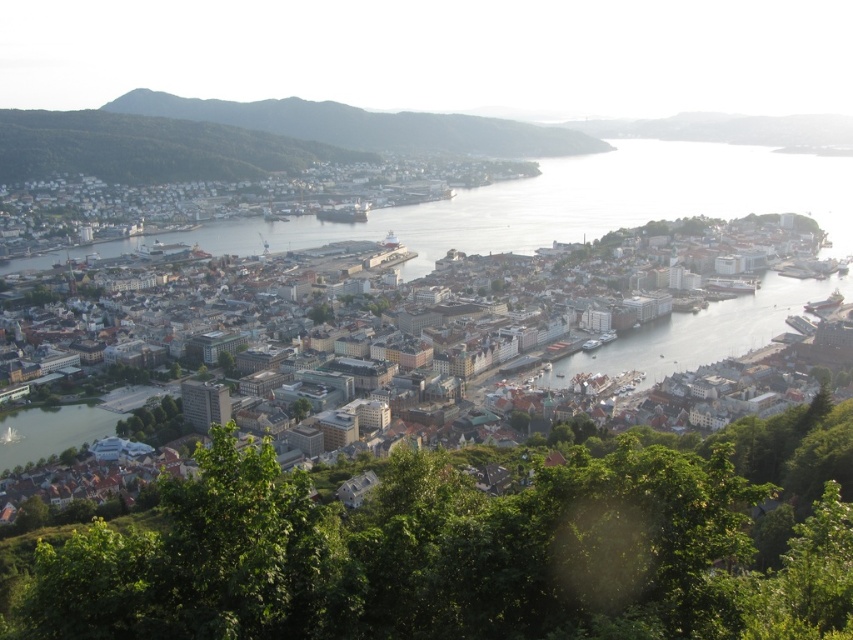
Does green leafy tree at lower center have a greater height compared to green forested hillside at upper left?

In fact, green leafy tree at lower center may be shorter than green forested hillside at upper left.

Who is higher up, green leafy tree at lower center or green forested hillside at upper left?

green forested hillside at upper left is higher up.

Who is more distant from viewer, (679,600) or (419,125)?

The point (419,125) is more distant.

Where is `green leafy tree at lower center`? Image resolution: width=853 pixels, height=640 pixels. green leafy tree at lower center is located at coordinates (466, 552).

How much distance is there between green leafy tree at lower center and white matte buildings at center?

green leafy tree at lower center and white matte buildings at center are 682.88 feet apart.

Is green leafy tree at lower center thinner than white matte buildings at center?

Yes, green leafy tree at lower center is thinner than white matte buildings at center.

Is point (172, 618) behind point (788, 308)?

No, it is in front of (788, 308).

Identify the location of green leafy tree at lower center. The image size is (853, 640). (466, 552).

How much distance is there between white matte buildings at center and green forested hillside at upper left?

They are 151.02 meters apart.

Can you confirm if white matte buildings at center is wider than green forested hillside at upper left?

Yes, white matte buildings at center is wider than green forested hillside at upper left.

Is point (741, 333) positioned in front of point (138, 99)?

Yes, it is in front of point (138, 99).

The height and width of the screenshot is (640, 853). Identify the location of white matte buildings at center. (70, 422).